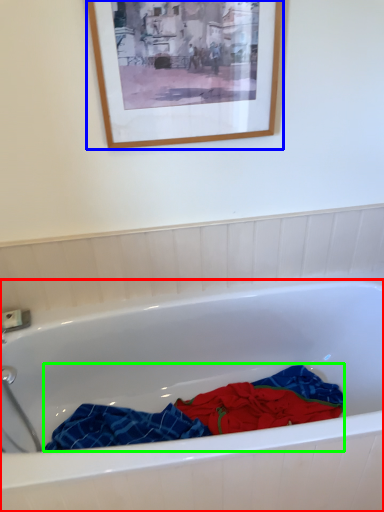
Question: Which is farther away from bathtub (highlighted by a red box)? picture frame (highlighted by a blue box) or material (highlighted by a green box)?

Choices:
 (A) picture frame
 (B) material

Answer: (A)